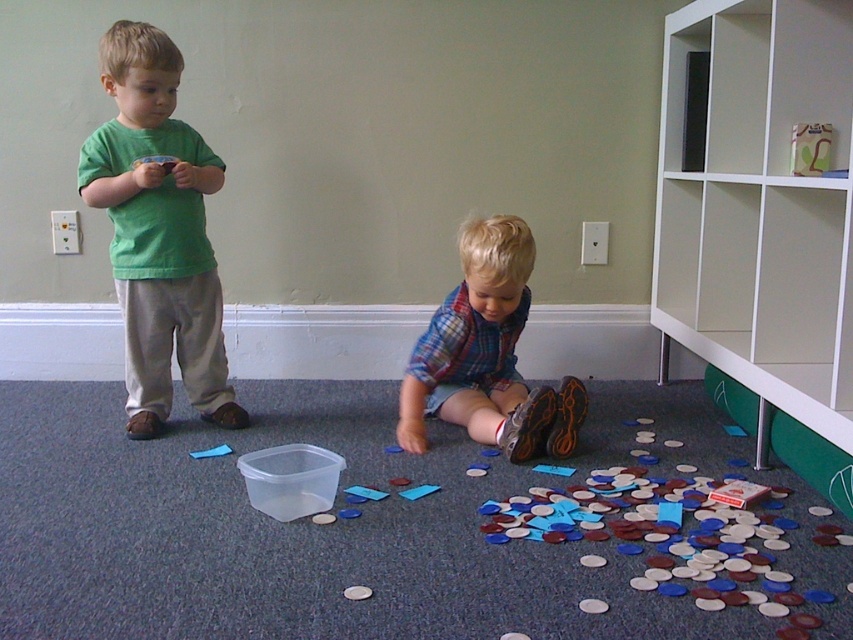
Question: Is green matte shirt at left to the right of plaid fabric shirt at lower center from the viewer's perspective?

Choices:
 (A) yes
 (B) no

Answer: (B)

Question: Is green matte shirt at left above plaid fabric shirt at lower center?

Choices:
 (A) yes
 (B) no

Answer: (A)

Question: Can you confirm if green matte shirt at left is bigger than plaid fabric shirt at lower center?

Choices:
 (A) no
 (B) yes

Answer: (B)

Question: Which point is farther to the camera?

Choices:
 (A) (144, 104)
 (B) (515, 451)

Answer: (B)